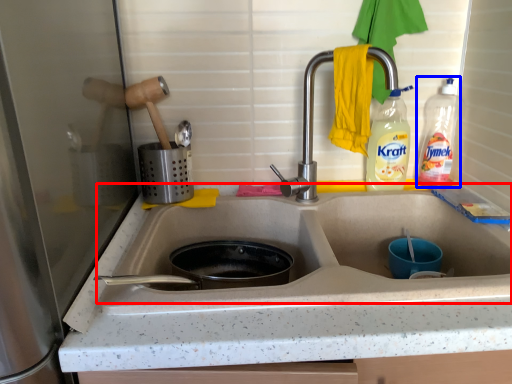
Question: Which object is closer to the camera taking this photo, sink (highlighted by a red box) or bottle (highlighted by a blue box)?

Choices:
 (A) sink
 (B) bottle

Answer: (A)